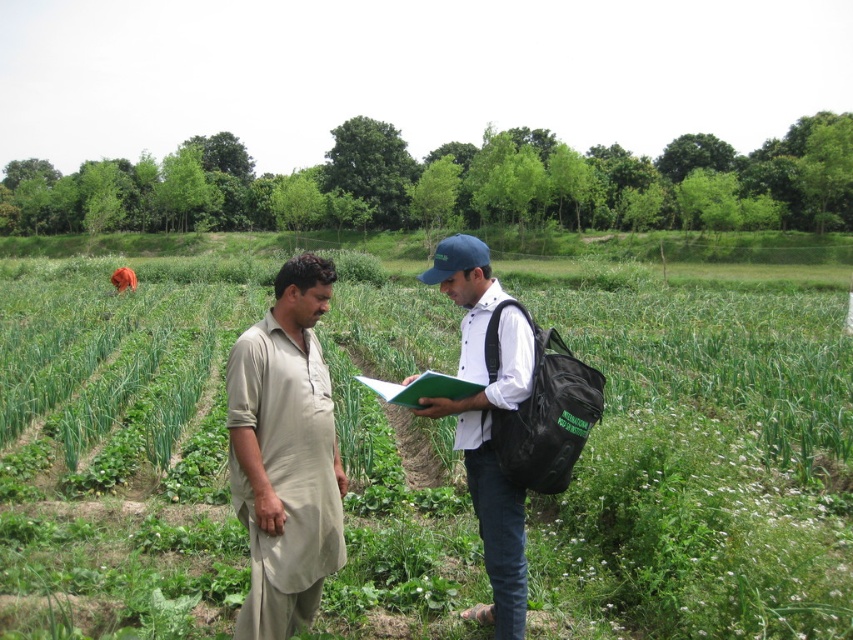
You are a photographer trying to capture both the beige cotton kurta at center and the white matte shirt at center in a single frame. Since you want to ensure both are clearly visible, which clothing item should you focus on first to avoid blurring due to size differences?

The beige cotton kurta at center is smaller than the white matte shirt at center, so you should focus on the beige cotton kurta at center first to ensure clarity before adjusting for the larger white matte shirt at center.